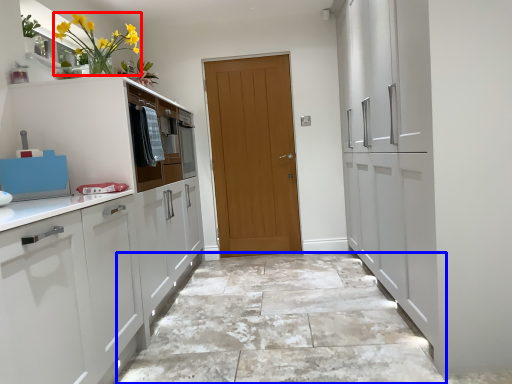
Question: Which of the following is the farthest to the observer, floral arrangement (highlighted by a red box) or granite (highlighted by a blue box)?

Choices:
 (A) floral arrangement
 (B) granite

Answer: (A)